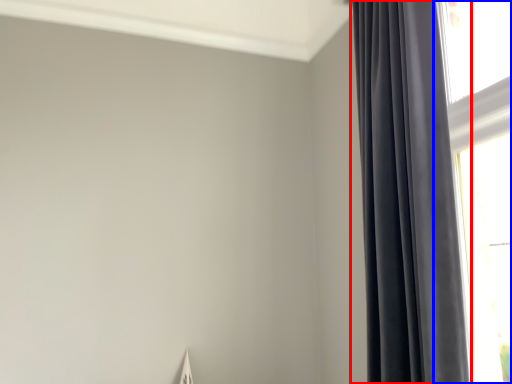
Question: Which object appears closest to the camera in this image, curtain (highlighted by a red box) or window (highlighted by a blue box)?

Choices:
 (A) curtain
 (B) window

Answer: (A)